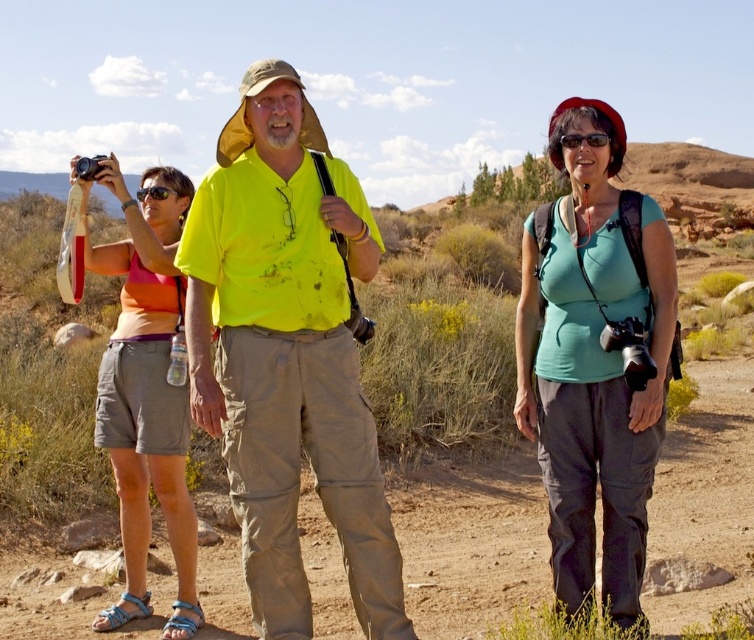
In the scene shown: Does yellow matte shirt at center lie in front of orange fabric tank top at left?

Yes, it is in front of orange fabric tank top at left.

Does point (375, 228) come farther from viewer compared to point (133, 392)?

That is False.

Is point (369, 548) positioned after point (182, 573)?

No, it is not.

Where is `yellow matte shirt at center`? This screenshot has width=754, height=640. yellow matte shirt at center is located at coordinates (287, 355).

Does teal fabric shirt at center appear on the left side of black plastic sunglasses at center?

Incorrect, teal fabric shirt at center is not on the left side of black plastic sunglasses at center.

Which is more to the right, teal fabric shirt at center or black plastic sunglasses at center?

teal fabric shirt at center is more to the right.

Is point (593, 358) farther from viewer compared to point (170, 192)?

No.

Find the location of `teal fabric shirt at center`. teal fabric shirt at center is located at coordinates (595, 356).

Is point (133, 323) in front of point (149, 186)?

Yes, point (133, 323) is closer to viewer.

Is orange fabric tank top at left positioned behind black plastic sunglasses at center?

No, it is not.

Which is behind, point (149, 362) or point (149, 188)?

The point (149, 188) is behind.

Where is `orange fabric tank top at left`? The width and height of the screenshot is (754, 640). orange fabric tank top at left is located at coordinates (146, 396).